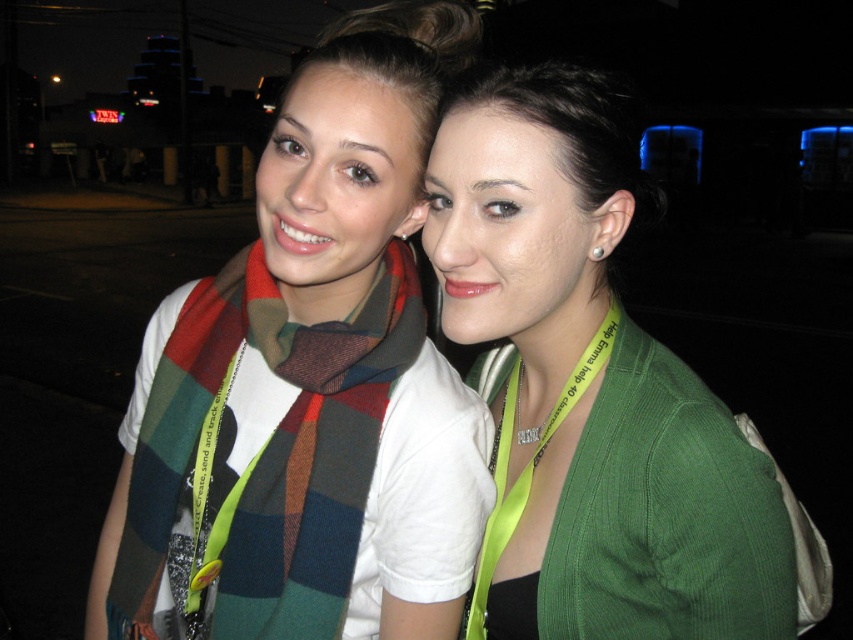
Question: Does green corduroy cardigan at center appear on the right side of plaid wool scarf at left?

Choices:
 (A) no
 (B) yes

Answer: (B)

Question: Is green corduroy cardigan at center positioned at the back of plaid wool scarf at left?

Choices:
 (A) no
 (B) yes

Answer: (A)

Question: Does green corduroy cardigan at center have a smaller size compared to plaid wool scarf at left?

Choices:
 (A) yes
 (B) no

Answer: (B)

Question: Which of the following is the farthest from the observer?

Choices:
 (A) (666, 529)
 (B) (338, 545)

Answer: (B)

Question: Which point is farther from the camera taking this photo?

Choices:
 (A) (213, 348)
 (B) (534, 268)

Answer: (A)